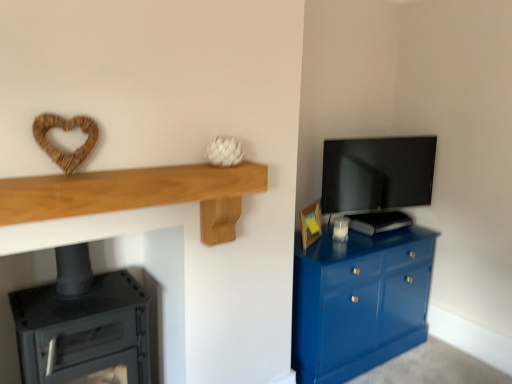
Image resolution: width=512 pixels, height=384 pixels. What do you see at coordinates (310, 224) in the screenshot?
I see `wooden picture frame at right` at bounding box center [310, 224].

In the scene shown: Measure the distance between point (362,313) and camera.

Point (362,313) and camera are 7.47 feet apart from each other.

Locate an element on the screen. This screenshot has height=384, width=512. light oak wood shelf at upper left is located at coordinates (137, 194).

This screenshot has height=384, width=512. What do you see at coordinates (137, 194) in the screenshot?
I see `light oak wood shelf at upper left` at bounding box center [137, 194].

Identify the location of black matte stove at lower left. (81, 323).

From a real-world perspective, is light oak wood shelf at upper left physically below matte black tv at upper right?

No, from a real-world perspective, light oak wood shelf at upper left is not beneath matte black tv at upper right.

Which of these two, light oak wood shelf at upper left or matte black tv at upper right, stands taller?

matte black tv at upper right is taller.

From the image's perspective, which one is positioned higher, light oak wood shelf at upper left or matte black tv at upper right?

From the image's view, matte black tv at upper right is above.

Which is behind, black matte stove at lower left or wooden picture frame at right?

wooden picture frame at right is more distant.

Looking at the image, does black matte stove at lower left seem bigger or smaller compared to wooden picture frame at right?

In the image, black matte stove at lower left appears to be larger than wooden picture frame at right.

Does black matte stove at lower left have a lesser height compared to wooden picture frame at right?

No, black matte stove at lower left is not shorter than wooden picture frame at right.

Between black matte stove at lower left and wooden picture frame at right, which one appears on the right side from the viewer's perspective?

Positioned to the right is wooden picture frame at right.

Considering the sizes of objects matte black tv at upper right and wooden picture frame at right in the image provided, who is taller, matte black tv at upper right or wooden picture frame at right?

matte black tv at upper right is taller.

Is matte black tv at upper right not close to wooden picture frame at right?

No, matte black tv at upper right is not far away from wooden picture frame at right.

Between matte black tv at upper right and wooden picture frame at right, which one has smaller width?

wooden picture frame at right.

Can you tell me how much matte black tv at upper right and wooden picture frame at right differ in facing direction?

43.1 degrees.

Could you tell me if glossy blue cabinet at right is facing black matte stove at lower left?

No.

From their relative heights in the image, would you say glossy blue cabinet at right is taller or shorter than black matte stove at lower left?

In the image, glossy blue cabinet at right appears to be shorter than black matte stove at lower left.

Between glossy blue cabinet at right and black matte stove at lower left, which one has smaller size?

black matte stove at lower left is smaller.

From the picture: Is black matte stove at lower left positioned with its back to light oak wood shelf at upper left?

No, black matte stove at lower left is not facing away from light oak wood shelf at upper left.

The image size is (512, 384). Identify the location of shelf on the right of black matte stove at lower left. (137, 194).

From a real-world perspective, is black matte stove at lower left positioned above or below light oak wood shelf at upper left?

In terms of real-world spatial position, black matte stove at lower left is below light oak wood shelf at upper left.

From the image's perspective, is light oak wood shelf at upper left located above glossy blue cabinet at right?

Yes.

Could you tell me if light oak wood shelf at upper left is facing glossy blue cabinet at right?

No, light oak wood shelf at upper left is not aimed at glossy blue cabinet at right.

Is point (212, 244) less distant than point (389, 340)?

Yes.

Considering the sizes of objects light oak wood shelf at upper left and glossy blue cabinet at right in the image provided, who is wider, light oak wood shelf at upper left or glossy blue cabinet at right?

glossy blue cabinet at right.

From the image's perspective, is wooden picture frame at right positioned above or below glossy blue cabinet at right?

Based on their image positions, wooden picture frame at right is located above glossy blue cabinet at right.

Considering the relative sizes of wooden picture frame at right and glossy blue cabinet at right in the image provided, is wooden picture frame at right taller than glossy blue cabinet at right?

No.

Considering the relative positions of wooden picture frame at right and glossy blue cabinet at right in the image provided, is wooden picture frame at right to the left of glossy blue cabinet at right from the viewer's perspective?

Correct, you'll find wooden picture frame at right to the left of glossy blue cabinet at right.

Considering the positions of point (309, 237) and point (420, 341), is point (309, 237) closer or farther from the camera than point (420, 341)?

Point (309, 237).

Where is `television below the light oak wood shelf at upper left (from a real-world perspective)`? The image size is (512, 384). television below the light oak wood shelf at upper left (from a real-world perspective) is located at coordinates [x=377, y=173].

Find the location of `picture frame located above the black matte stove at lower left (from a real-world perspective)`. picture frame located above the black matte stove at lower left (from a real-world perspective) is located at coordinates (310, 224).

Based on their spatial positions, is wooden picture frame at right or matte black tv at upper right closer to black matte stove at lower left?

wooden picture frame at right is closer to black matte stove at lower left.

Based on their spatial positions, is glossy blue cabinet at right or black matte stove at lower left further from matte black tv at upper right?

black matte stove at lower left lies further to matte black tv at upper right than the other object.

Looking at the image, which one is located closer to glossy blue cabinet at right, black matte stove at lower left or wooden picture frame at right?

wooden picture frame at right.

Based on their spatial positions, is wooden picture frame at right or matte black tv at upper right further from glossy blue cabinet at right?

Among the two, matte black tv at upper right is located further to glossy blue cabinet at right.

Which object lies nearer to the anchor point wooden picture frame at right, matte black tv at upper right or glossy blue cabinet at right?

Among the two, matte black tv at upper right is located nearer to wooden picture frame at right.

Looking at the image, which one is located further to glossy blue cabinet at right, wooden picture frame at right or black matte stove at lower left?

black matte stove at lower left is positioned further to the anchor glossy blue cabinet at right.

Considering their positions, is glossy blue cabinet at right positioned closer to black matte stove at lower left than wooden picture frame at right?

Among the two, glossy blue cabinet at right is located nearer to black matte stove at lower left.

Considering their positions, is glossy blue cabinet at right positioned closer to light oak wood shelf at upper left than matte black tv at upper right?

Among the two, glossy blue cabinet at right is located nearer to light oak wood shelf at upper left.

In order to click on chest of drawers between black matte stove at lower left and matte black tv at upper right in the horizontal direction in this screenshot , I will do `click(359, 301)`.

You are a GUI agent. You are given a task and a screenshot of the screen. Output one action in this format:
    pyautogui.click(x=<x>, y=<y>)
    Task: Click on the chest of drawers between light oak wood shelf at upper left and matte black tv at upper right in the front-back direction
    This screenshot has height=384, width=512.
    Given the screenshot: What is the action you would take?
    pyautogui.click(x=359, y=301)

Where is `picture frame between light oak wood shelf at upper left and matte black tv at upper right from front to back`? Image resolution: width=512 pixels, height=384 pixels. picture frame between light oak wood shelf at upper left and matte black tv at upper right from front to back is located at coordinates point(310,224).

Identify the location of picture frame situated between black matte stove at lower left and glossy blue cabinet at right from left to right. Image resolution: width=512 pixels, height=384 pixels. (310, 224).